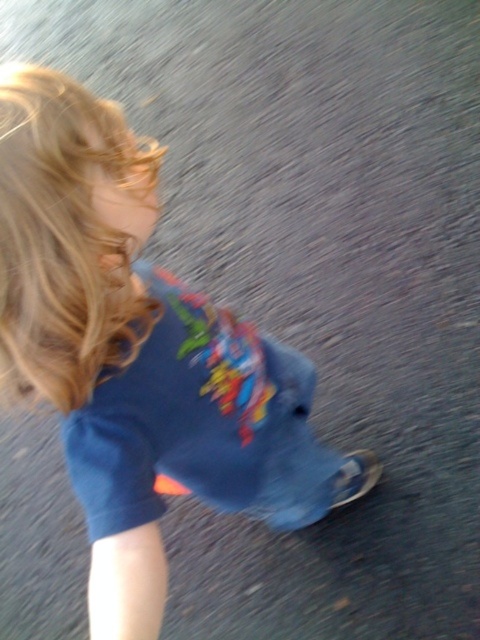
Does blue cotton shirt at center appear over blonde curly hair at upper left?

No.

Which of these two, blue cotton shirt at center or blonde curly hair at upper left, stands taller?

blue cotton shirt at center is taller.

The height and width of the screenshot is (640, 480). What do you see at coordinates (139, 353) in the screenshot? I see `blue cotton shirt at center` at bounding box center [139, 353].

In order to click on blue cotton shirt at center in this screenshot , I will do `click(139, 353)`.